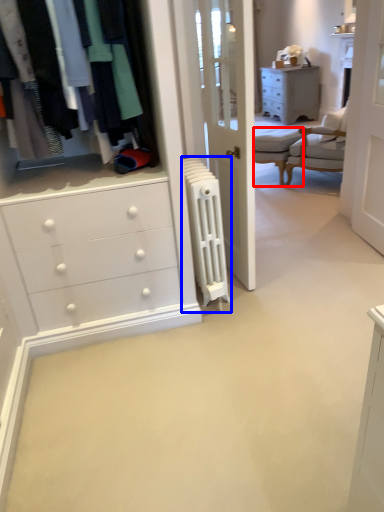
Question: Among these objects, which one is nearest to the camera, armchair (highlighted by a red box) or radiator (highlighted by a blue box)?

Choices:
 (A) armchair
 (B) radiator

Answer: (B)